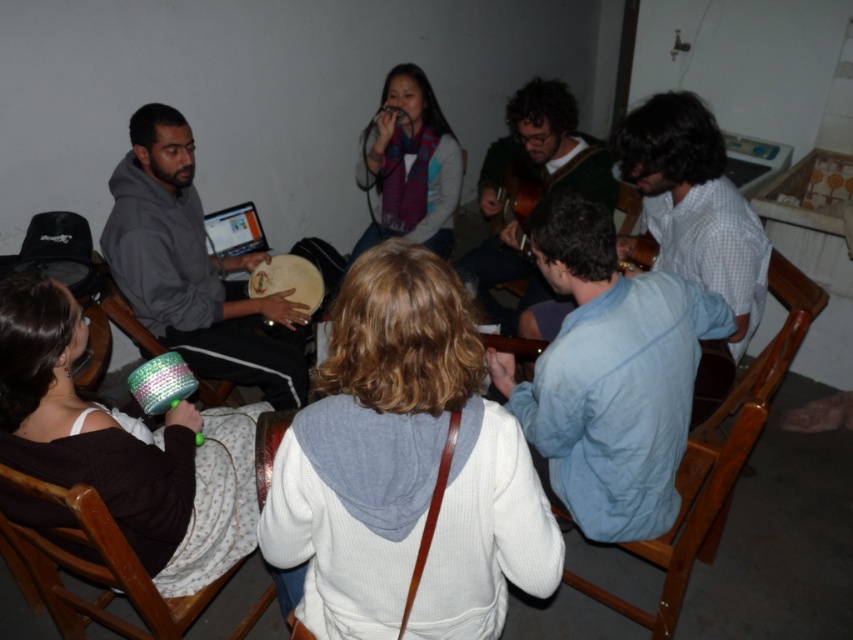
Does dark brown hair at center come behind knitted scarf at center?

No, it is not.

Based on the photo, does dark brown hair at center lie in front of knitted scarf at center?

Yes, it is.

Identify the location of dark brown hair at center. The image size is (853, 640). (544, 148).

Can you confirm if wooden chair at lower left is positioned to the right of metallic sequined tambourine at lower left?

Yes, wooden chair at lower left is to the right of metallic sequined tambourine at lower left.

Consider the image. Is wooden chair at lower left above metallic sequined tambourine at lower left?

No, wooden chair at lower left is not above metallic sequined tambourine at lower left.

Who is more forward, (x=132, y=625) or (x=142, y=333)?

Point (x=132, y=625)

Identify the location of wooden chair at lower left. The image size is (853, 640). (90, 568).

Between white soft sweater at center and knitted fabric drum at lower left, which one has less height?

white soft sweater at center is shorter.

Between white soft sweater at center and knitted fabric drum at lower left, which one is positioned higher?

Positioned higher is knitted fabric drum at lower left.

Is point (393, 326) less distant than point (155, 531)?

Yes, it is.

Where is `white soft sweater at center`? Image resolution: width=853 pixels, height=640 pixels. white soft sweater at center is located at coordinates (405, 467).